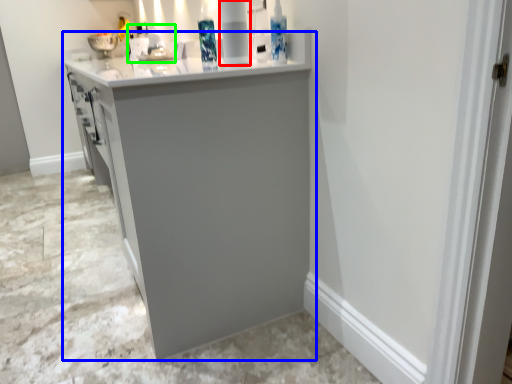
Question: Which object is the farthest from appliance (highlighted by a red box)? Choose among these: cabinetry (highlighted by a blue box) or sink (highlighted by a green box).

Choices:
 (A) cabinetry
 (B) sink

Answer: (B)